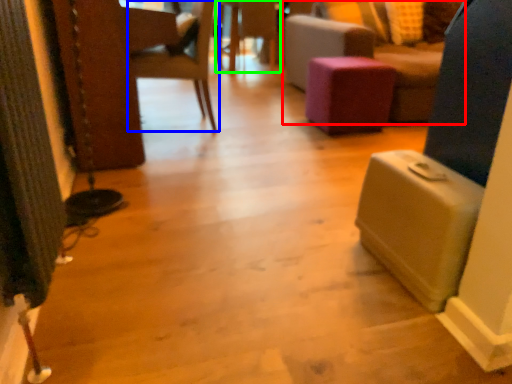
Question: Which object is positioned closest to furniture (highlighted by a red box)? Select from chair (highlighted by a blue box) and side table (highlighted by a green box).

Choices:
 (A) chair
 (B) side table

Answer: (B)